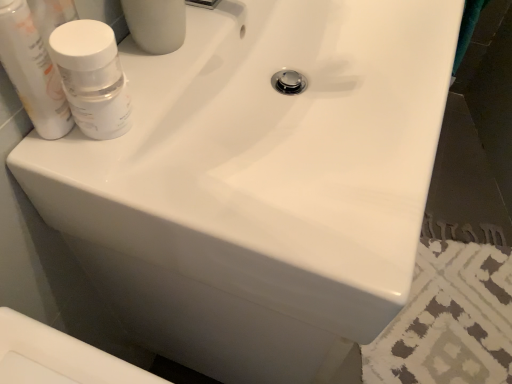
At what (x,y) coordinates should I click in order to perform the action: click on vacant space behind white matte bottle at upper left, which is counted as the 1th mouthwash, starting from the right. Please return your answer as a coordinate pair (x, y). This screenshot has height=384, width=512. Looking at the image, I should click on (176, 60).